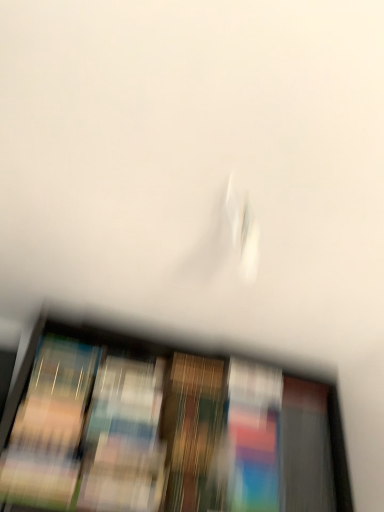
Locate an element on the screen. The height and width of the screenshot is (512, 384). wooden at center is located at coordinates (166, 428).

Describe the element at coordinates (166, 428) in the screenshot. I see `wooden at center` at that location.

I want to click on wooden at center, so click(x=166, y=428).